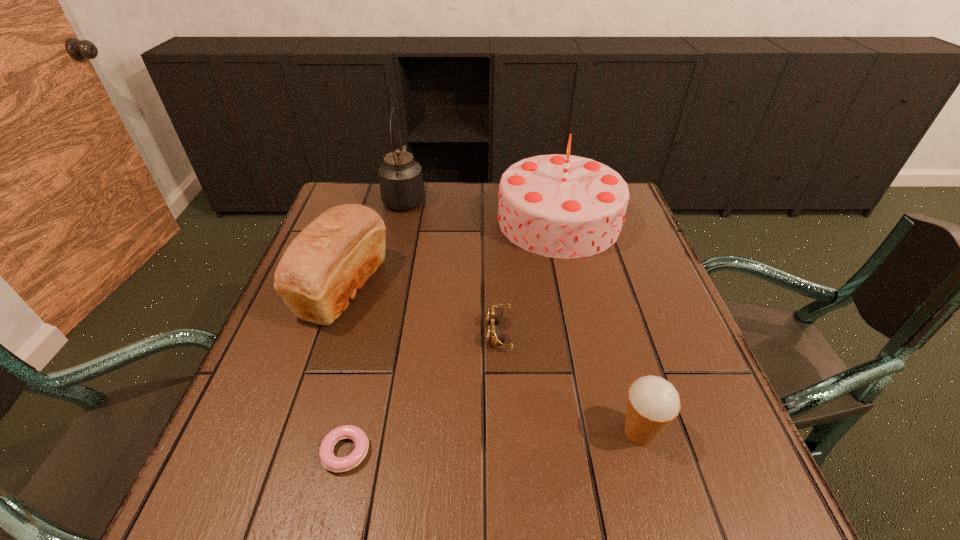
This screenshot has width=960, height=540. I want to click on vacant space situated through the lenses of the fifth tallest object, so click(x=326, y=332).

Identify the location of vacant space located 0.340m through the lenses of the fifth tallest object. (326, 332).

I want to click on free space located on the back of the shortest object, so click(x=360, y=390).

The width and height of the screenshot is (960, 540). What are the coordinates of `kettle that is at the far edge` in the screenshot? It's located at (401, 180).

You are a GUI agent. You are given a task and a screenshot of the screen. Output one action in this format:
    pyautogui.click(x=<x>, y=<y>)
    Task: Click on the birthday cake present at the far edge
    The height and width of the screenshot is (540, 960).
    Given the screenshot: What is the action you would take?
    pyautogui.click(x=562, y=206)

The height and width of the screenshot is (540, 960). In order to click on object that is at the near edge in this screenshot , I will do `click(331, 462)`.

Image resolution: width=960 pixels, height=540 pixels. What are the coordinates of `kettle that is at the left edge` in the screenshot? It's located at (401, 180).

Where is `bread that is at the left edge`? The width and height of the screenshot is (960, 540). bread that is at the left edge is located at coordinates (331, 259).

Locate an element on the screen. birthday cake at the right edge is located at coordinates (562, 206).

Find the location of a particular element. icecream at the right edge is located at coordinates pos(653,403).